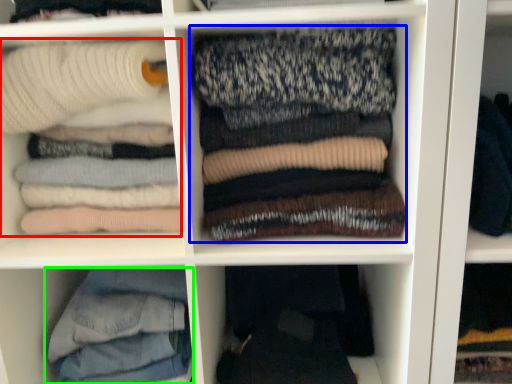
Question: Which object is the farthest from laundry (highlighted by a red box)? Choose among these: laundry (highlighted by a blue box) or trousers (highlighted by a green box).

Choices:
 (A) laundry
 (B) trousers

Answer: (B)